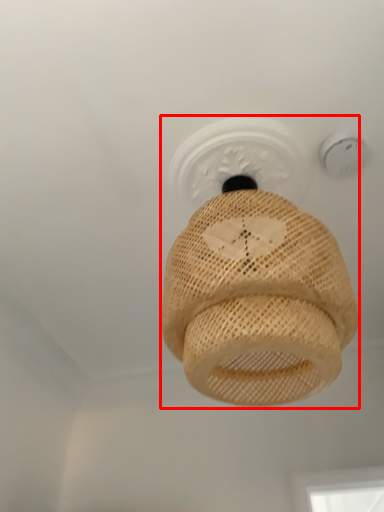
Question: From the image, what is the correct spatial relationship of lamp (annotated by the red box) in relation to light fixture?

Choices:
 (A) left
 (B) right

Answer: (A)